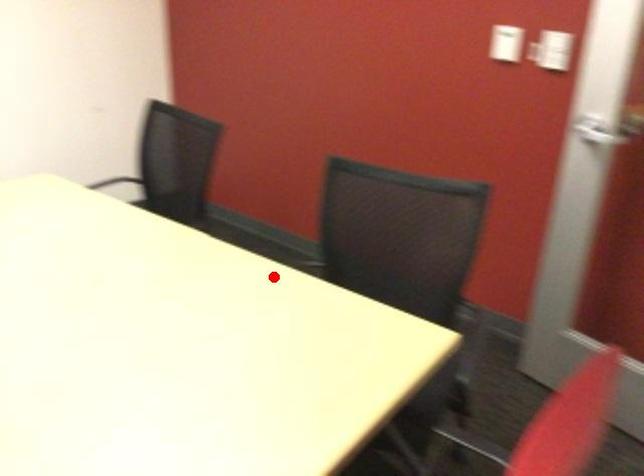
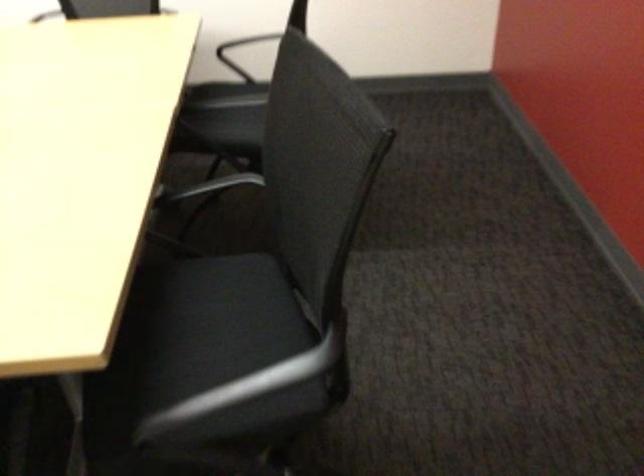
Find the pixel in the second image that matches the highlighted location in the first image.

(209, 186)